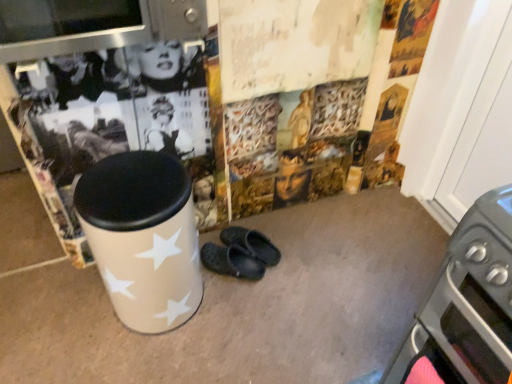
What do you see at coordinates (468, 302) in the screenshot? This screenshot has height=384, width=512. I see `metallic gray oven at lower right` at bounding box center [468, 302].

This screenshot has height=384, width=512. What are the coordinates of `black rubber clogs at center` in the screenshot? It's located at (240, 254).

Locate an element on the screen. metallic stainless steel microwave at upper left is located at coordinates (93, 25).

What do you see at coordinates (93, 25) in the screenshot? I see `metallic stainless steel microwave at upper left` at bounding box center [93, 25].

Find the location of `white glossy trash can at center`. white glossy trash can at center is located at coordinates (143, 237).

The image size is (512, 384). I want to click on waste container that is under the metallic gray oven at lower right (from a real-world perspective), so click(143, 237).

Considering their positions, is white glossy trash can at center located in front of or behind metallic gray oven at lower right?

In the image, white glossy trash can at center appears behind metallic gray oven at lower right.

From the picture: From the image's perspective, which object appears higher, white glossy trash can at center or metallic gray oven at lower right?

white glossy trash can at center is shown above in the image.

Considering the positions of objects white glossy trash can at center and metallic gray oven at lower right in the image provided, who is more to the right, white glossy trash can at center or metallic gray oven at lower right?

From the viewer's perspective, metallic gray oven at lower right appears more on the right side.

Is white glossy trash can at center bigger or smaller than black rubber clogs at center?

white glossy trash can at center is bigger than black rubber clogs at center.

From the image's perspective, who appears lower, white glossy trash can at center or black rubber clogs at center?

black rubber clogs at center.

Is white glossy trash can at center oriented away from black rubber clogs at center?

white glossy trash can at center does not have its back to black rubber clogs at center.

Identify the location of footwear lying behind the white glossy trash can at center. This screenshot has width=512, height=384. (240, 254).

Considering the sizes of objects metallic stainless steel microwave at upper left and black rubber clogs at center in the image provided, who is smaller, metallic stainless steel microwave at upper left or black rubber clogs at center?

With smaller size is black rubber clogs at center.

From the image's perspective, would you say metallic stainless steel microwave at upper left is positioned over black rubber clogs at center?

Yes, from the image's perspective, metallic stainless steel microwave at upper left is above black rubber clogs at center.

Locate an element on the screen. footwear below the metallic stainless steel microwave at upper left (from the image's perspective) is located at coordinates (240, 254).

From a real-world perspective, is metallic stainless steel microwave at upper left over black rubber clogs at center?

Yes, from a real-world perspective, metallic stainless steel microwave at upper left is above black rubber clogs at center.

Which of these two, metallic gray oven at lower right or black rubber clogs at center, stands shorter?

black rubber clogs at center.

How far apart are metallic gray oven at lower right and black rubber clogs at center?

They are 33.42 inches apart.

Can you confirm if metallic gray oven at lower right is positioned to the right of black rubber clogs at center?

Indeed, metallic gray oven at lower right is positioned on the right side of black rubber clogs at center.

Is metallic gray oven at lower right turned away from black rubber clogs at center?

No, metallic gray oven at lower right is not facing the opposite direction of black rubber clogs at center.

From a real-world perspective, is black rubber clogs at center on top of metallic stainless steel microwave at upper left?

No, from a real-world perspective, black rubber clogs at center is not above metallic stainless steel microwave at upper left.

From the image's perspective, who appears lower, black rubber clogs at center or metallic stainless steel microwave at upper left?

black rubber clogs at center is shown below in the image.

Does black rubber clogs at center have a lesser width compared to metallic stainless steel microwave at upper left?

Yes, black rubber clogs at center is thinner than metallic stainless steel microwave at upper left.

What's the angular difference between black rubber clogs at center and metallic stainless steel microwave at upper left's facing directions?

black rubber clogs at center and metallic stainless steel microwave at upper left are facing 38.7 degrees away from each other.

Is metallic stainless steel microwave at upper left touching white glossy trash can at center?

Result: There is a gap between metallic stainless steel microwave at upper left and white glossy trash can at center.

Considering the relative sizes of metallic stainless steel microwave at upper left and white glossy trash can at center in the image provided, is metallic stainless steel microwave at upper left bigger than white glossy trash can at center?

No.

From a real-world perspective, is metallic stainless steel microwave at upper left located beneath white glossy trash can at center?

No.

Is metallic stainless steel microwave at upper left aimed at white glossy trash can at center?

No.

Does metallic gray oven at lower right have a lesser width compared to metallic stainless steel microwave at upper left?

Incorrect, the width of metallic gray oven at lower right is not less than that of metallic stainless steel microwave at upper left.

Is metallic gray oven at lower right smaller than metallic stainless steel microwave at upper left?

No.

Does metallic gray oven at lower right turn towards metallic stainless steel microwave at upper left?

No, metallic gray oven at lower right is not turned towards metallic stainless steel microwave at upper left.

From the image's perspective, which one is positioned higher, metallic gray oven at lower right or metallic stainless steel microwave at upper left?

metallic stainless steel microwave at upper left.

Where is `home appliance on the right of white glossy trash can at center`? home appliance on the right of white glossy trash can at center is located at coordinates (468, 302).

Where is `waste container in front of the black rubber clogs at center`? This screenshot has width=512, height=384. waste container in front of the black rubber clogs at center is located at coordinates point(143,237).

Based on their spatial positions, is white glossy trash can at center or metallic gray oven at lower right further from black rubber clogs at center?

metallic gray oven at lower right is further to black rubber clogs at center.

In the scene shown: When comparing their distances from white glossy trash can at center, does black rubber clogs at center or metallic stainless steel microwave at upper left seem further?

The object further to white glossy trash can at center is metallic stainless steel microwave at upper left.

Which object lies nearer to the anchor point white glossy trash can at center, metallic gray oven at lower right or metallic stainless steel microwave at upper left?

metallic stainless steel microwave at upper left is closer to white glossy trash can at center.

When comparing their distances from black rubber clogs at center, does metallic gray oven at lower right or metallic stainless steel microwave at upper left seem further?

metallic stainless steel microwave at upper left lies further to black rubber clogs at center than the other object.

Looking at the image, which one is located further to black rubber clogs at center, metallic gray oven at lower right or white glossy trash can at center?

Based on the image, metallic gray oven at lower right appears to be further to black rubber clogs at center.

Which object lies nearer to the anchor point metallic stainless steel microwave at upper left, white glossy trash can at center or metallic gray oven at lower right?

white glossy trash can at center.

Considering their positions, is metallic stainless steel microwave at upper left positioned further to metallic gray oven at lower right than white glossy trash can at center?

metallic stainless steel microwave at upper left is positioned further to the anchor metallic gray oven at lower right.

From the image, which object appears to be nearer to metallic gray oven at lower right, black rubber clogs at center or metallic stainless steel microwave at upper left?

black rubber clogs at center is positioned closer to the anchor metallic gray oven at lower right.

Locate an element on the screen. This screenshot has height=384, width=512. footwear between metallic stainless steel microwave at upper left and metallic gray oven at lower right in the horizontal direction is located at coordinates (240, 254).

Find the location of a particular element. This screenshot has height=384, width=512. appliance between white glossy trash can at center and metallic gray oven at lower right in the horizontal direction is located at coordinates (93, 25).

Where is `waste container between metallic stainless steel microwave at upper left and black rubber clogs at center along the z-axis`? The height and width of the screenshot is (384, 512). waste container between metallic stainless steel microwave at upper left and black rubber clogs at center along the z-axis is located at coordinates (143, 237).

Where is `footwear between white glossy trash can at center and metallic gray oven at lower right in the horizontal direction`? footwear between white glossy trash can at center and metallic gray oven at lower right in the horizontal direction is located at coordinates (240, 254).